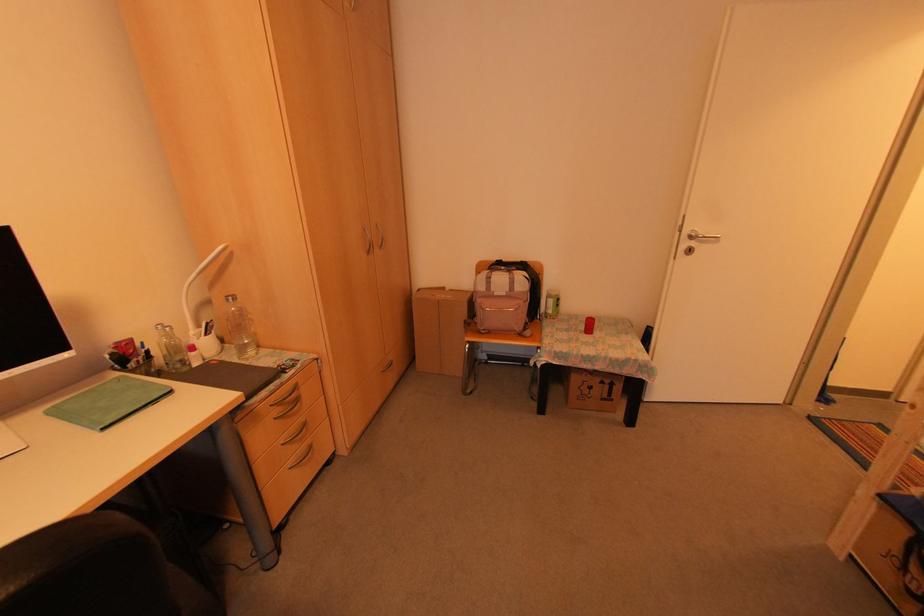
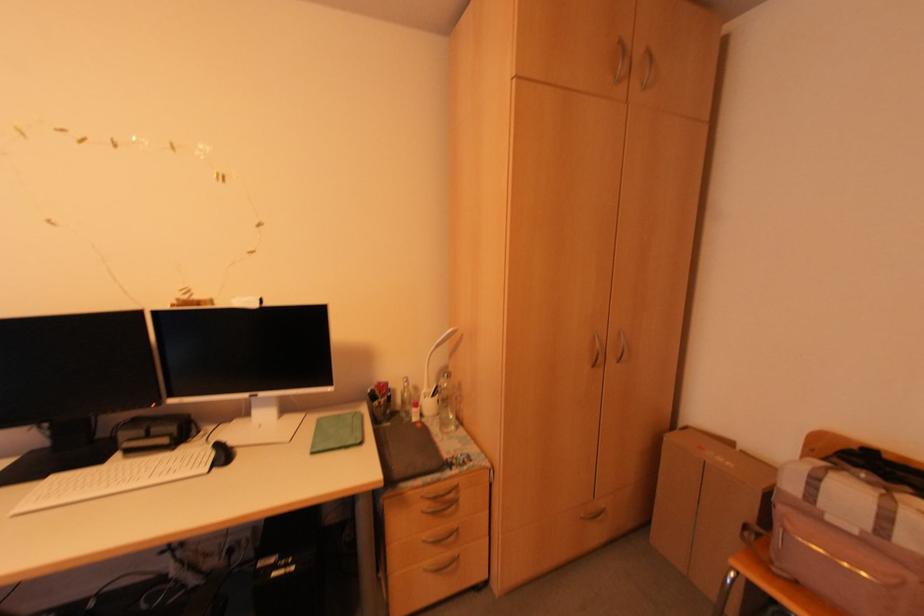
The point at (388,359) is marked in the first image. Where is the corresponding point in the second image?

(602, 506)